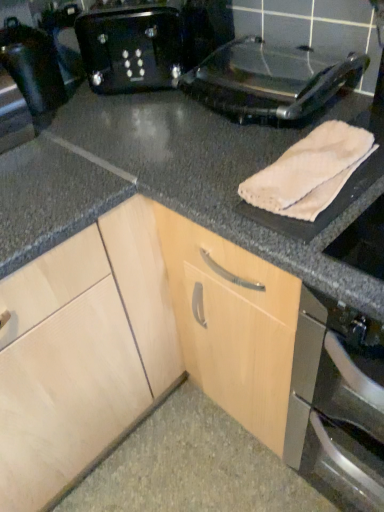
Question: Is black plastic toaster at upper center taller than white fabric towel at right?

Choices:
 (A) no
 (B) yes

Answer: (A)

Question: Is black plastic toaster at upper center aimed at white fabric towel at right?

Choices:
 (A) yes
 (B) no

Answer: (B)

Question: From a real-world perspective, is black plastic toaster at upper center below white fabric towel at right?

Choices:
 (A) yes
 (B) no

Answer: (B)

Question: From the image's perspective, is black plastic toaster at upper center below white fabric towel at right?

Choices:
 (A) yes
 (B) no

Answer: (B)

Question: Are black plastic toaster at upper center and white fabric towel at right beside each other?

Choices:
 (A) yes
 (B) no

Answer: (B)

Question: From a real-world perspective, is black plastic toaster at upper center physically above white fabric towel at right?

Choices:
 (A) yes
 (B) no

Answer: (A)

Question: From the image's perspective, is black plastic toaster at upper center on shiny black toaster at left?

Choices:
 (A) yes
 (B) no

Answer: (A)

Question: Is black plastic toaster at upper center wider than shiny black toaster at left?

Choices:
 (A) yes
 (B) no

Answer: (A)

Question: From the image's perspective, is black plastic toaster at upper center under shiny black toaster at left?

Choices:
 (A) yes
 (B) no

Answer: (B)

Question: Is black plastic toaster at upper center in front of shiny black toaster at left?

Choices:
 (A) no
 (B) yes

Answer: (A)

Question: Is black plastic toaster at upper center turned away from shiny black toaster at left?

Choices:
 (A) no
 (B) yes

Answer: (A)

Question: Considering the relative positions of black plastic toaster at upper center and shiny black toaster at left in the image provided, is black plastic toaster at upper center to the left of shiny black toaster at left from the viewer's perspective?

Choices:
 (A) no
 (B) yes

Answer: (A)

Question: From the image's perspective, would you say shiny black toaster at left is positioned over beige soft towel at upper right?

Choices:
 (A) no
 (B) yes

Answer: (B)